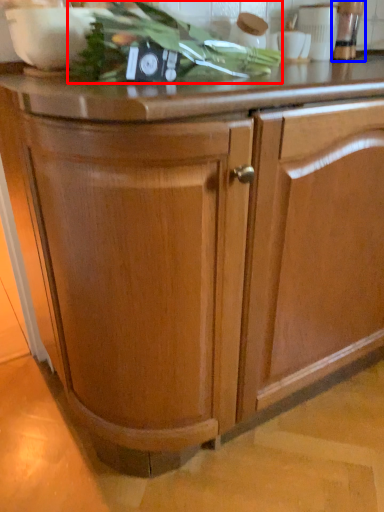
Question: Among these objects, which one is nearest to the camera, vegetable (highlighted by a red box) or appliance (highlighted by a blue box)?

Choices:
 (A) vegetable
 (B) appliance

Answer: (A)